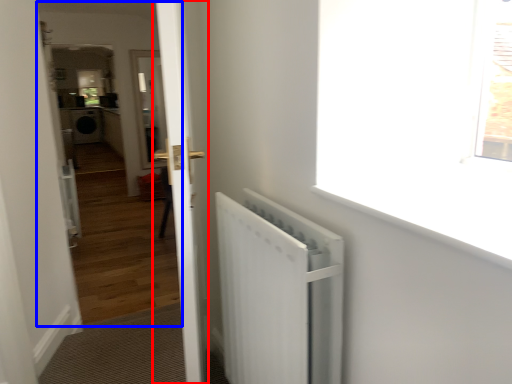
Question: Which point is further to the camera, door (highlighted by a red box) or corridor (highlighted by a blue box)?

Choices:
 (A) door
 (B) corridor

Answer: (B)